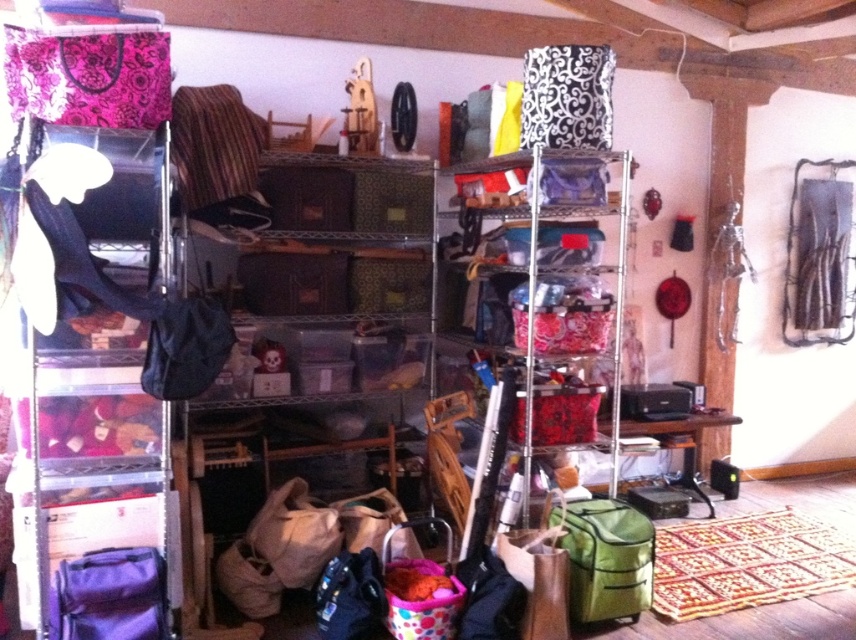
Question: Which point is closer to the camera?

Choices:
 (A) green fabric bag at lower right
 (B) matte purple duffel at lower left
 (C) matte beige fabric bag at lower center

Answer: (B)

Question: Which object is positioned closest to the matte beige fabric bag at lower center?

Choices:
 (A) matte purple duffel at lower left
 (B) green fabric bag at lower right

Answer: (A)

Question: Is matte purple duffel at lower left to the left of matte beige fabric bag at lower center from the viewer's perspective?

Choices:
 (A) no
 (B) yes

Answer: (B)

Question: Estimate the real-world distances between objects in this image. Which object is farther from the matte beige fabric bag at lower center?

Choices:
 (A) matte purple duffel at lower left
 (B) green fabric bag at lower right

Answer: (B)

Question: Is matte purple duffel at lower left wider than matte beige fabric bag at lower center?

Choices:
 (A) no
 (B) yes

Answer: (A)

Question: Does matte purple duffel at lower left have a larger size compared to matte beige fabric bag at lower center?

Choices:
 (A) yes
 (B) no

Answer: (B)